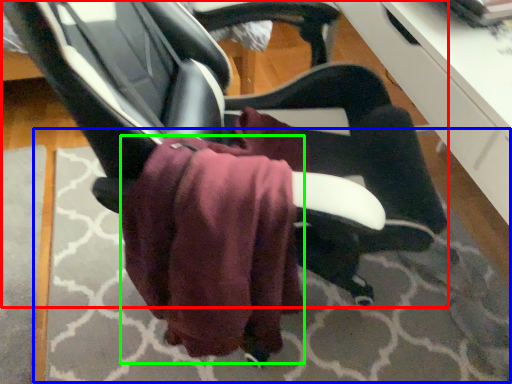
Question: Which object is the closest to the chair (highlighted by a red box)? Choose among these: mat (highlighted by a blue box) or bath towel (highlighted by a green box).

Choices:
 (A) mat
 (B) bath towel

Answer: (B)